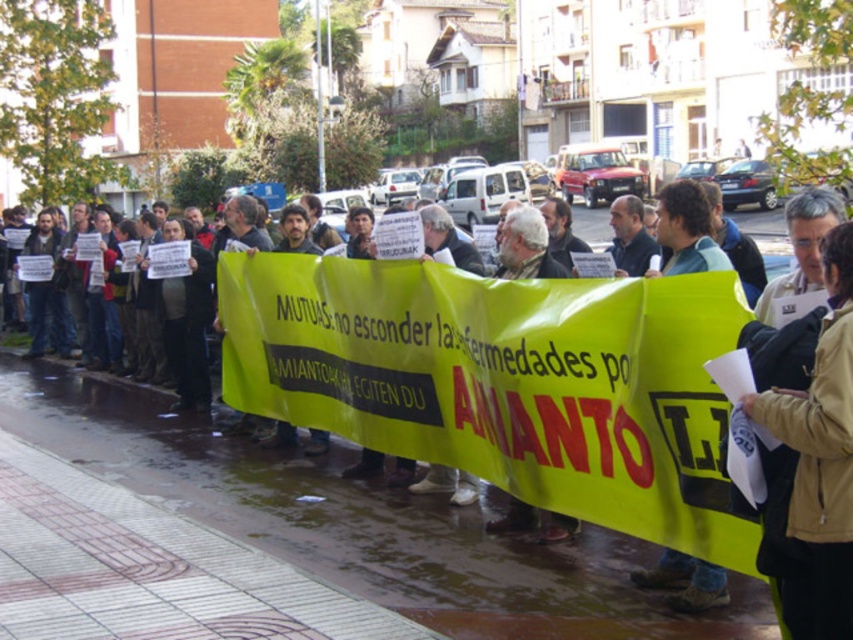
You are a photographer standing at the camera position. You want to take a closeup shot of the point at coordinates (817, 458). The minimum focus distance of your camera is 10 feet. Can you focus on that point?

The point at coordinates (817, 458) is 12.12 feet away from the camera. Since the minimum focus distance is 10 feet, the camera can focus on the point as it is beyond the minimum distance required.